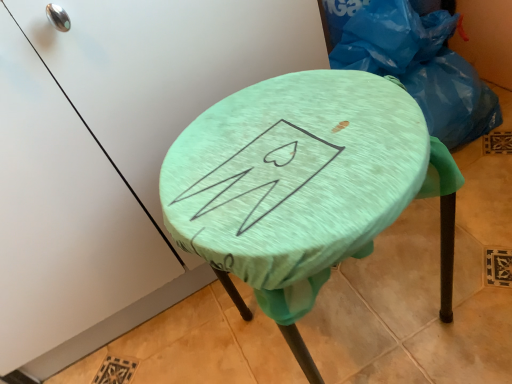
Describe the element at coordinates (303, 186) in the screenshot. I see `mint fabric-covered stool at center` at that location.

In order to click on mint fabric-covered stool at center in this screenshot , I will do `click(303, 186)`.

Image resolution: width=512 pixels, height=384 pixels. I want to click on blue plastic bag at upper right, so click(x=416, y=64).

What do you see at coordinates (416, 64) in the screenshot?
I see `blue plastic bag at upper right` at bounding box center [416, 64].

Where is `mint fabric-covered stool at center`? Image resolution: width=512 pixels, height=384 pixels. mint fabric-covered stool at center is located at coordinates (303, 186).

Between blue plastic bag at upper right and mint fabric-covered stool at center, which one appears on the left side from the viewer's perspective?

mint fabric-covered stool at center is more to the left.

Which is in front, blue plastic bag at upper right or mint fabric-covered stool at center?

mint fabric-covered stool at center is in front.

Considering the positions of points (447, 101) and (306, 306), is point (447, 101) farther from camera compared to point (306, 306)?

Yes, point (447, 101) is farther from viewer.

From the image's perspective, relative to mint fabric-covered stool at center, is blue plastic bag at upper right above or below?

Based on their image positions, blue plastic bag at upper right is located above mint fabric-covered stool at center.

From a real-world perspective, relative to mint fabric-covered stool at center, is blue plastic bag at upper right vertically above or below?

Clearly, from a real-world perspective, blue plastic bag at upper right is above mint fabric-covered stool at center.

Does blue plastic bag at upper right have a lesser width compared to mint fabric-covered stool at center?

Correct, the width of blue plastic bag at upper right is less than that of mint fabric-covered stool at center.

Between blue plastic bag at upper right and mint fabric-covered stool at center, which one has more height?

With more height is mint fabric-covered stool at center.

Considering the sizes of objects blue plastic bag at upper right and mint fabric-covered stool at center in the image provided, who is smaller, blue plastic bag at upper right or mint fabric-covered stool at center?

With smaller size is blue plastic bag at upper right.

Is blue plastic bag at upper right inside the boundaries of mint fabric-covered stool at center, or outside?

blue plastic bag at upper right exists outside the volume of mint fabric-covered stool at center.

Is blue plastic bag at upper right not close to mint fabric-covered stool at center?

No, blue plastic bag at upper right is not far from mint fabric-covered stool at center.

Does blue plastic bag at upper right turn towards mint fabric-covered stool at center?

No.

Can you tell me how much blue plastic bag at upper right and mint fabric-covered stool at center differ in facing direction?

There is a 0.000123-degree angle between the facing directions of blue plastic bag at upper right and mint fabric-covered stool at center.

In the image, there is a blue plastic bag at upper right. At what (x,y) coordinates should I click in order to perform the action: click on furniture below it (from the image's perspective). Please return your answer as a coordinate pair (x, y). This screenshot has height=384, width=512. Looking at the image, I should click on (303, 186).

Is mint fabric-covered stool at center to the left of blue plastic bag at upper right from the viewer's perspective?

Indeed, mint fabric-covered stool at center is positioned on the left side of blue plastic bag at upper right.

Consider the image. Is mint fabric-covered stool at center positioned behind blue plastic bag at upper right?

No, mint fabric-covered stool at center is closer to the camera.

Is point (405, 118) closer or farther from the camera than point (444, 61)?

Point (405, 118) appears to be closer to the viewer than point (444, 61).

From the image's perspective, which one is positioned lower, mint fabric-covered stool at center or blue plastic bag at upper right?

From the image's view, mint fabric-covered stool at center is below.

From a real-world perspective, is mint fabric-covered stool at center above or below blue plastic bag at upper right?

Clearly, from a real-world perspective, mint fabric-covered stool at center is below blue plastic bag at upper right.

Consider the image. Which object is thinner, mint fabric-covered stool at center or blue plastic bag at upper right?

blue plastic bag at upper right is thinner.

In the scene shown: Considering the sizes of objects mint fabric-covered stool at center and blue plastic bag at upper right in the image provided, who is shorter, mint fabric-covered stool at center or blue plastic bag at upper right?

blue plastic bag at upper right.

Considering the sizes of objects mint fabric-covered stool at center and blue plastic bag at upper right in the image provided, who is smaller, mint fabric-covered stool at center or blue plastic bag at upper right?

With smaller size is blue plastic bag at upper right.

Is mint fabric-covered stool at center outside of blue plastic bag at upper right?

Yes, mint fabric-covered stool at center is located beyond the bounds of blue plastic bag at upper right.

Is mint fabric-covered stool at center far from blue plastic bag at upper right?

No, mint fabric-covered stool at center is not far from blue plastic bag at upper right.

Is mint fabric-covered stool at center facing towards blue plastic bag at upper right?

No, mint fabric-covered stool at center is not facing towards blue plastic bag at upper right.

At what (x,y) coordinates should I click in order to perform the action: click on furniture lying below the blue plastic bag at upper right (from the image's perspective). Please return your answer as a coordinate pair (x, y). This screenshot has width=512, height=384. Looking at the image, I should click on (303, 186).

Locate an element on the screen. The height and width of the screenshot is (384, 512). garbage above the mint fabric-covered stool at center (from a real-world perspective) is located at coordinates (416, 64).

Find the location of `furniture lying in front of the blue plastic bag at upper right`. furniture lying in front of the blue plastic bag at upper right is located at coordinates click(x=303, y=186).